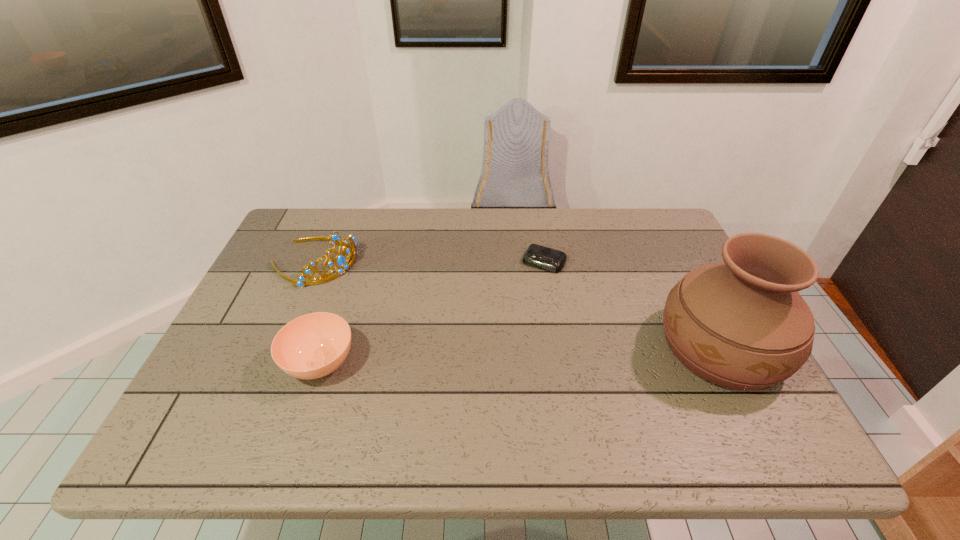
Locate an element on the screen. Image resolution: width=960 pixels, height=540 pixels. free space located 0.130m on the display of the third object from left to right is located at coordinates (519, 302).

At what (x,y) coordinates should I click in order to perform the action: click on vacant space situated 0.370m on the front-facing side of the tiara. Please return your answer as a coordinate pair (x, y). Looking at the image, I should click on (453, 329).

Find the location of a particular element. Image resolution: width=960 pixels, height=540 pixels. vacant space situated 0.240m on the front-facing side of the tiara is located at coordinates (412, 309).

The width and height of the screenshot is (960, 540). In order to click on vacant space located 0.120m on the front-facing side of the tiara in this screenshot , I will do `click(377, 292)`.

This screenshot has height=540, width=960. Find the location of `alarm clock that is at the far edge`. alarm clock that is at the far edge is located at coordinates (538, 256).

Find the location of a particular element. The image size is (960, 540). tiara at the far edge is located at coordinates (340, 260).

The width and height of the screenshot is (960, 540). Find the location of `soup bowl located at the near edge`. soup bowl located at the near edge is located at coordinates (312, 346).

Identify the location of urn at the near edge. (742, 324).

What are the coordinates of `object present at the left edge` in the screenshot? It's located at (340, 260).

Find the location of `object that is at the right edge`. object that is at the right edge is located at coordinates (742, 324).